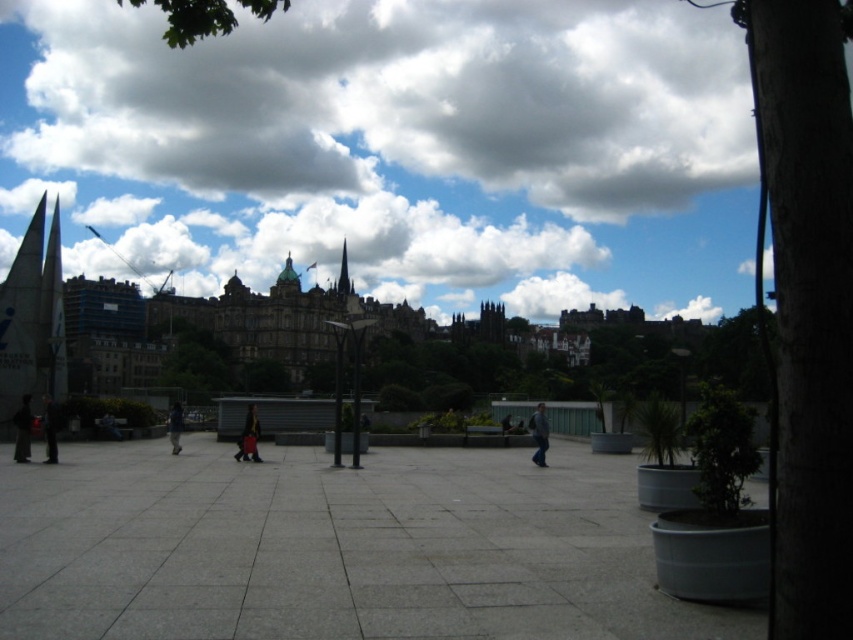
You are standing in the plaza and want to place a small potted plant between the dark matte coat at lower left and the dark gray stone spire at center. Based on their positions, which object should the potted plant be closer to?

The dark matte coat at lower left is located below the dark gray stone spire at center, so the potted plant should be placed closer to the dark gray stone spire at center to maintain a balanced arrangement between the two objects.

You are standing in the plaza and notice the dark matte coat at lower left and the dark gray stone spire at center. Which object is shorter?

The dark matte coat at lower left is shorter than the dark gray stone spire at center.